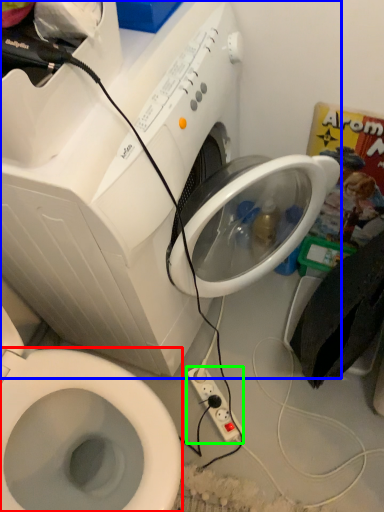
Question: Estimate the real-world distances between objects in this image. Which object is farther from bidet (highlighted by a red box), washing machine (highlighted by a blue box) or power plugs and sockets (highlighted by a green box)?

Choices:
 (A) washing machine
 (B) power plugs and sockets

Answer: (B)